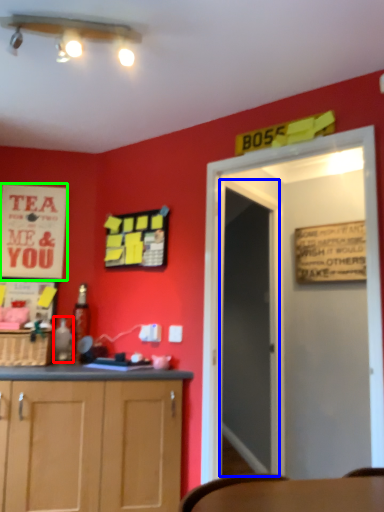
Question: Considering the real-world distances, which object is farthest from bottle (highlighted by a red box)? glass door (highlighted by a blue box) or poster (highlighted by a green box)?

Choices:
 (A) glass door
 (B) poster

Answer: (A)